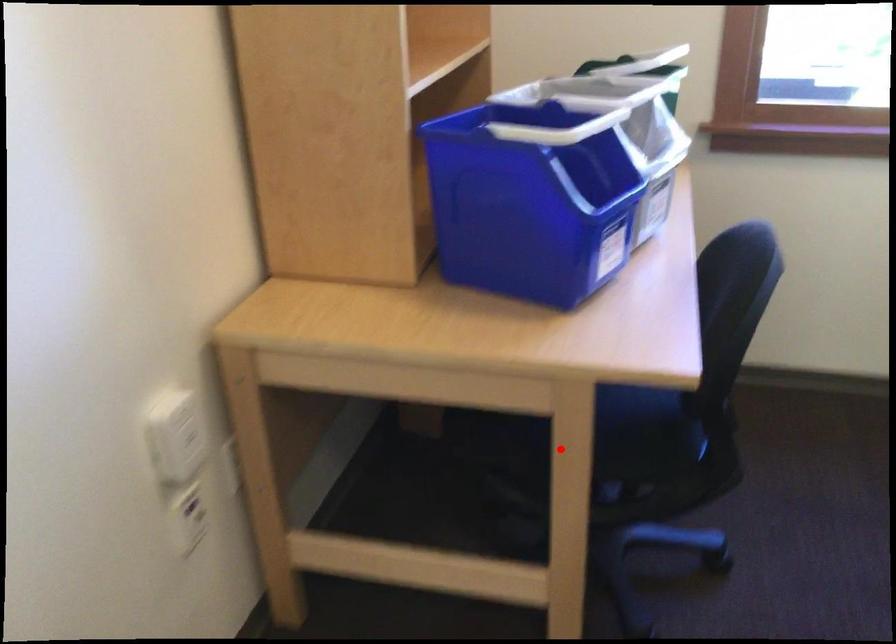
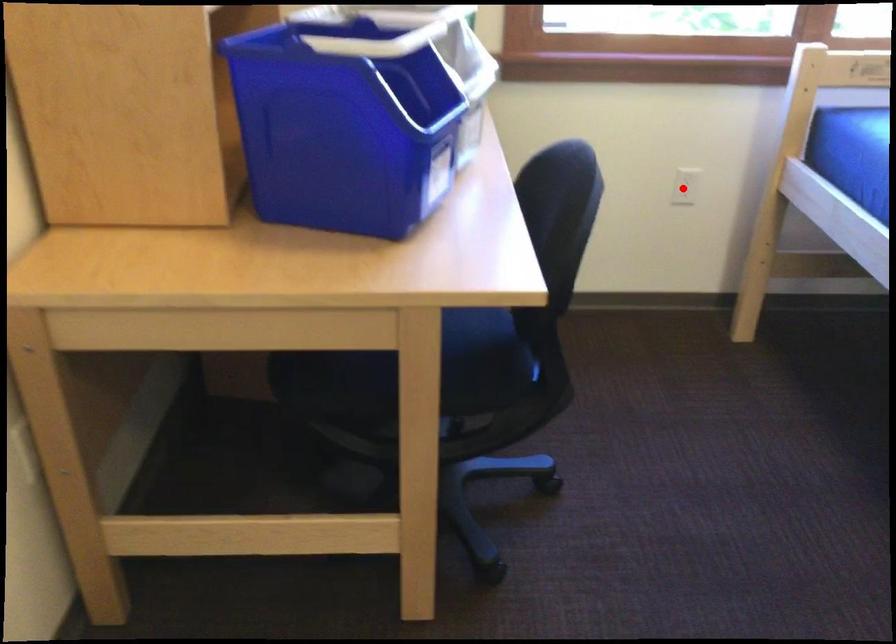
I am providing you with two images of the same scene from different viewpoints. A red point is marked on the first image and another point is marked on the second image. Is the red point in image1 aligned with the point shown in image2?

No